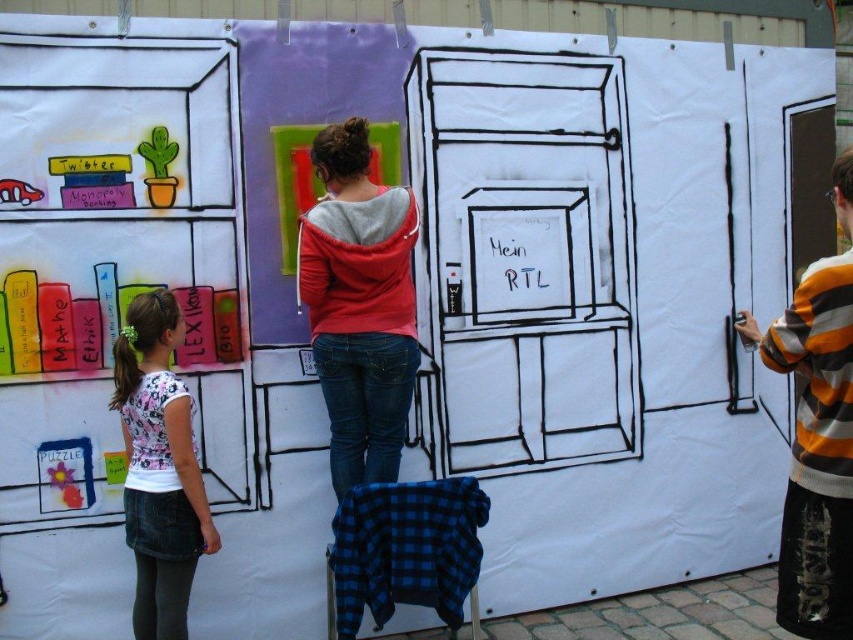
Can you confirm if red hoodie at center is wider than white printed shirt at left?

Incorrect, red hoodie at center's width does not surpass white printed shirt at left's.

Is red hoodie at center thinner than white printed shirt at left?

Indeed, red hoodie at center has a lesser width compared to white printed shirt at left.

Which is behind, point (399, 355) or point (180, 580)?

The point (399, 355) is more distant.

Where is `red hoodie at center`? The width and height of the screenshot is (853, 640). red hoodie at center is located at coordinates (358, 305).

Does point (810, 483) lie in front of point (170, 502)?

Yes, point (810, 483) is closer to viewer.

Can you confirm if striped sweater at right is bigger than white printed shirt at left?

Actually, striped sweater at right might be smaller than white printed shirt at left.

Image resolution: width=853 pixels, height=640 pixels. Identify the location of striped sweater at right. (817, 435).

Which of these two, red hoodie at center or striped sweater at right, stands taller?

striped sweater at right

Does red hoodie at center appear on the left side of striped sweater at right?

Yes, red hoodie at center is to the left of striped sweater at right.

Is point (345, 268) less distant than point (820, 422)?

No, (345, 268) is behind (820, 422).

Locate an element on the screen. red hoodie at center is located at coordinates (358, 305).